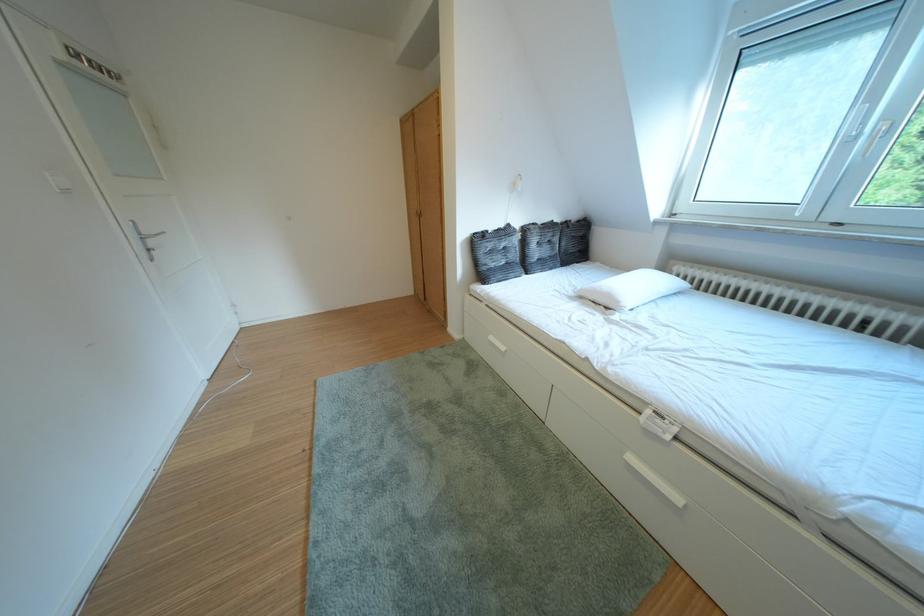
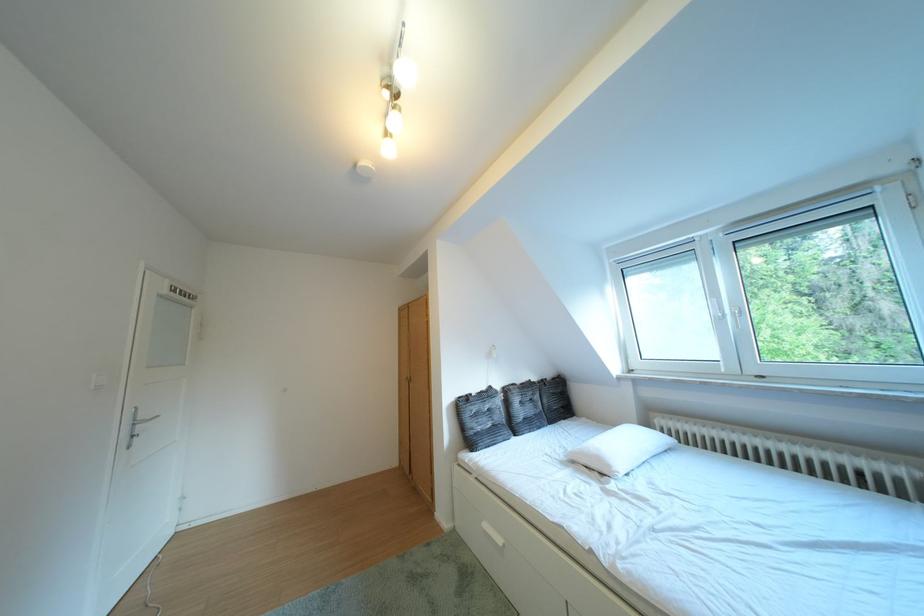
The point at (523, 230) is marked in the first image. Where is the corresponding point in the second image?

(504, 392)